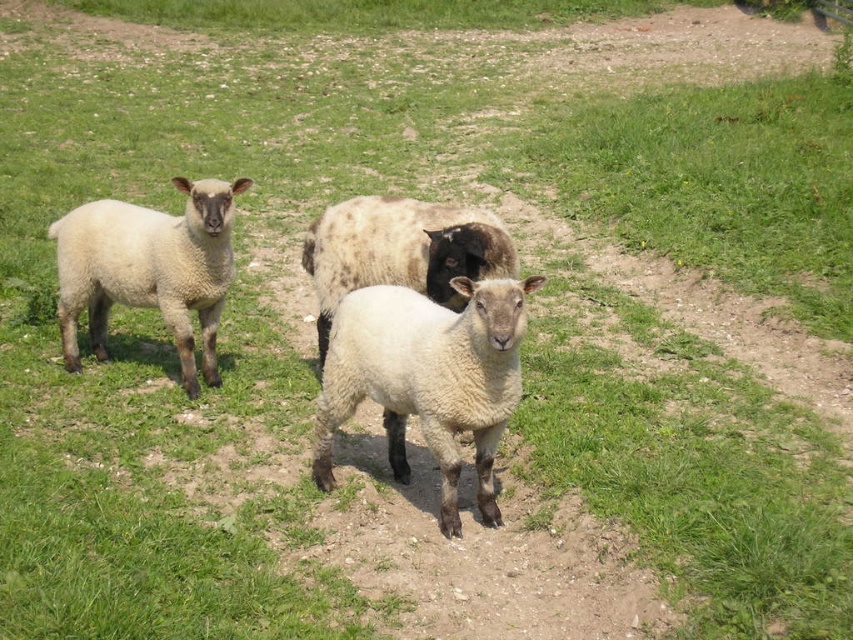
You are a farmer checking the sheep in the field. You notice a white woolen lamb at center and a white woolen sheep at center. Which one is casting a shadow on the other?

The white woolen sheep at center is casting a shadow on the white woolen lamb at center because the lamb is positioned under the sheep.

You are a farmer checking the flock. You notice the white woolly lamb at left and the white woolen sheep at center. Which one is bigger?

The white woolly lamb at left is larger in size than the white woolen sheep at center.